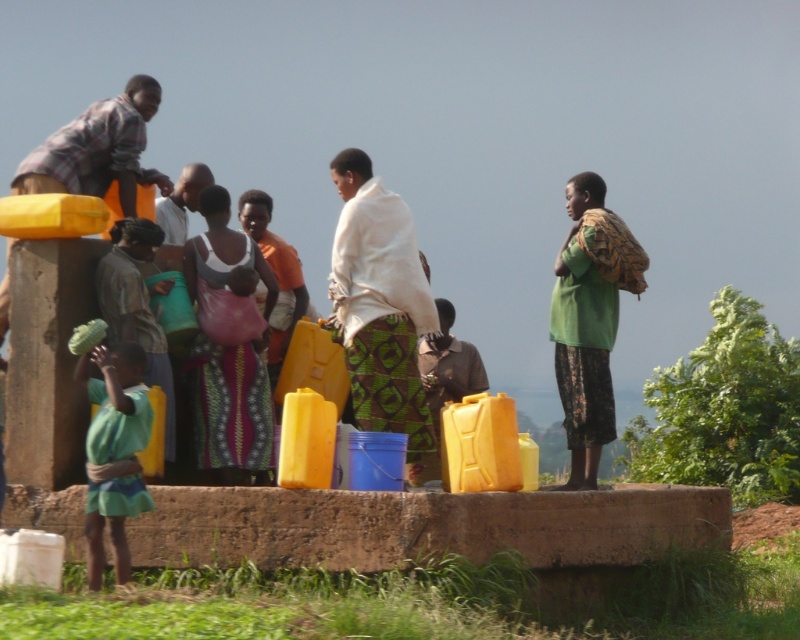
You are a photographer standing at the center of the scene. You want to take a photo that includes both the point at coordinates point [238,324] and point [150,406]. Which point should you focus on first to ensure both are in focus?

You should focus on point [238,324] first because it is closer to the camera than point [150,406]. By focusing on the closer point, the farther point will also be in focus due to depth of field.

You are organizing a community event where participants need to stand side by side. Given the space available, which participant, the one wearing the patterned fabric dress at center or the green fabric shirt at lower left, would require more space due to their clothing width?

The patterned fabric dress at center requires more space because its width surpasses that of the green fabric shirt at lower left.